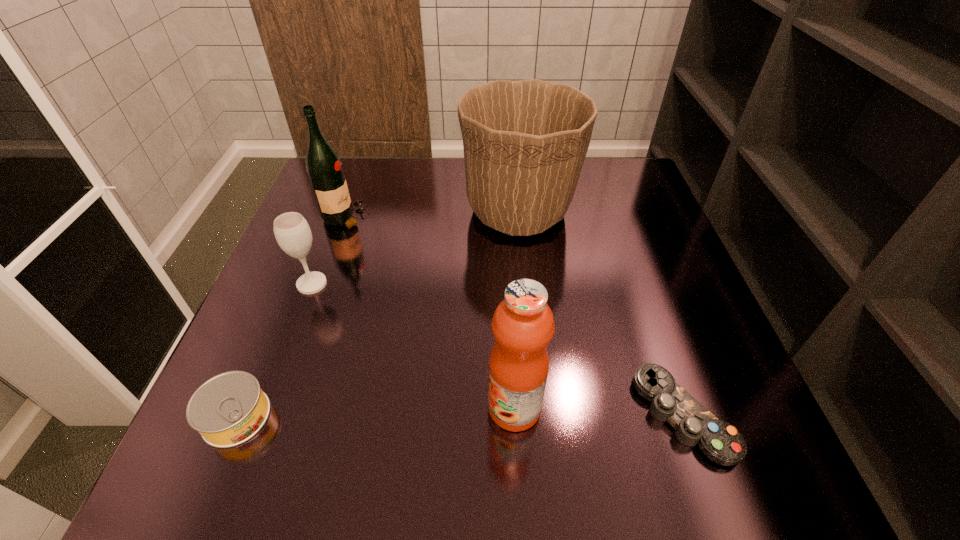
Locate an element on the screen. The width and height of the screenshot is (960, 540). wine bottle at the left edge is located at coordinates (324, 168).

This screenshot has height=540, width=960. I want to click on wineglass at the left edge, so click(292, 232).

You are a GUI agent. You are given a task and a screenshot of the screen. Output one action in this format:
    pyautogui.click(x=<x>, y=<y>)
    Task: Click on the can that is at the left edge
    Image resolution: width=960 pixels, height=540 pixels.
    Given the screenshot: What is the action you would take?
    pyautogui.click(x=230, y=408)

Where is `object that is at the right edge`? The height and width of the screenshot is (540, 960). object that is at the right edge is located at coordinates tap(721, 442).

Find the location of a particular element. object positioned at the far left corner is located at coordinates (324, 168).

At what (x,y) coordinates should I click in order to perform the action: click on object located in the near left corner section of the desktop. Please return your answer as a coordinate pair (x, y). The width and height of the screenshot is (960, 540). Looking at the image, I should click on (230, 408).

The height and width of the screenshot is (540, 960). Find the location of `object that is at the near right corner`. object that is at the near right corner is located at coordinates (721, 442).

Find the location of a particular element. The height and width of the screenshot is (540, 960). vacant space at the far edge of the desktop is located at coordinates (452, 205).

Locate an element on the screen. Image resolution: width=960 pixels, height=540 pixels. vacant space at the near edge of the desktop is located at coordinates (570, 442).

Locate an element on the screen. free space at the left edge of the desktop is located at coordinates (302, 335).